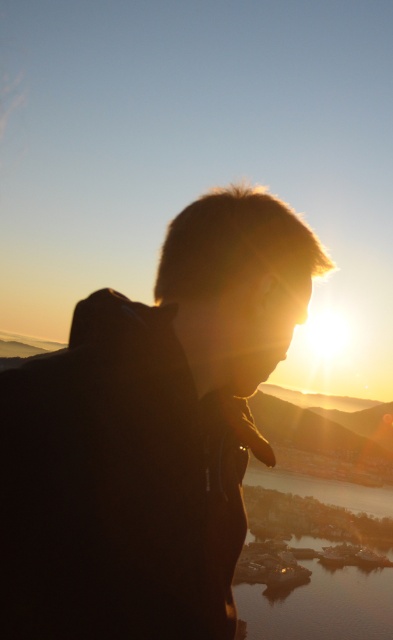
Question: Is black matte jacket at center in front of shiny reflective water at lower center?

Choices:
 (A) no
 (B) yes

Answer: (B)

Question: From the image, what is the correct spatial relationship of black matte jacket at center in relation to shiny reflective water at lower center?

Choices:
 (A) below
 (B) above

Answer: (B)

Question: Does black matte jacket at center come in front of shiny reflective water at lower center?

Choices:
 (A) yes
 (B) no

Answer: (A)